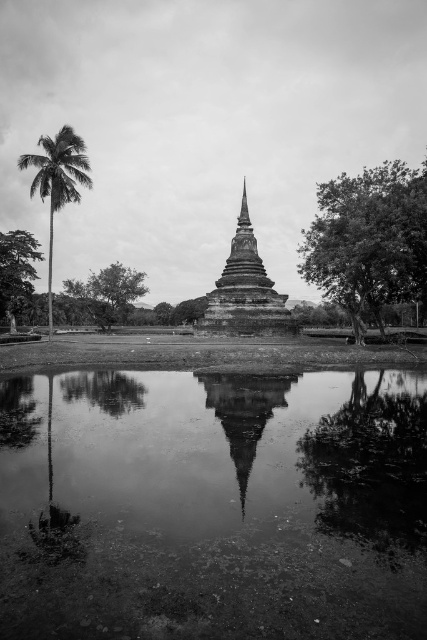
You are a photographer trying to capture the smooth bark tree at right in your shot. Based on its coordinates, where should you position your camera to ensure it is centered in the frame?

To center the smooth bark tree at right in your frame, position your camera so that it aligns with the coordinates point 0.377 on the horizontal axis and 0.864 on the vertical axis.

Based on the scene description, where is the smooth stone stupa at center located in the image?

The smooth stone stupa at center is located at point (245,291) in the image.

You are a photographer planning to capture a symmetrical composition of the smooth stone stupa at center and the smooth bark tree at right. Given their sizes, which object should you position closer to the camera to maintain symmetry?

To maintain symmetry between the smooth bark tree at right and the smooth stone stupa at center, you should position the smooth bark tree at right closer to the camera since it is bigger than the smooth stone stupa at center. This adjustment will help balance their sizes in the frame.